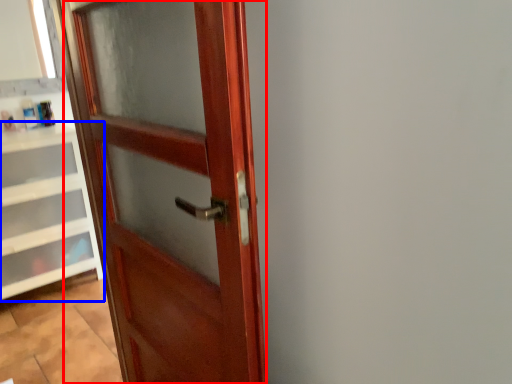
Question: Which point is closer to the camera, door (highlighted by a red box) or cabinetry (highlighted by a blue box)?

Choices:
 (A) door
 (B) cabinetry

Answer: (A)